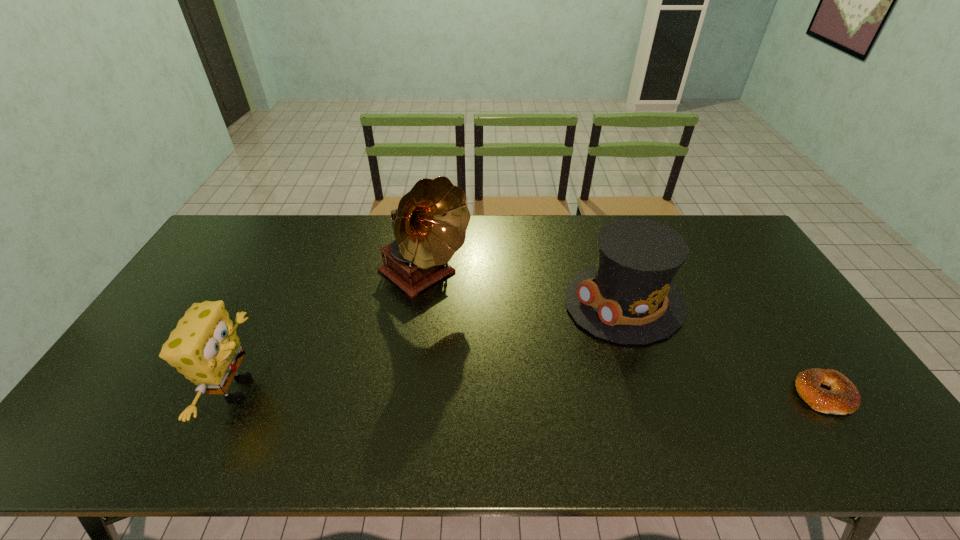
Image resolution: width=960 pixels, height=540 pixels. What are the coordinates of `vacant region at the near edge of the desktop` in the screenshot? It's located at (434, 402).

In the image, there is a desktop. At what (x,y) coordinates should I click in order to perform the action: click on free space at the left edge. Please return your answer as a coordinate pair (x, y). The height and width of the screenshot is (540, 960). Looking at the image, I should click on (170, 315).

In the image, there is a desktop. At what (x,y) coordinates should I click in order to perform the action: click on free space at the right edge. Please return your answer as a coordinate pair (x, y). The height and width of the screenshot is (540, 960). Looking at the image, I should click on (783, 354).

The width and height of the screenshot is (960, 540). In the image, there is a desktop. In order to click on vacant space at the far left corner in this screenshot , I will do `click(219, 253)`.

This screenshot has width=960, height=540. I want to click on empty space that is in between the sponge and the rightmost object, so click(531, 392).

Image resolution: width=960 pixels, height=540 pixels. I want to click on unoccupied position between the leftmost object and the rightmost object, so click(531, 392).

Find the location of `free space between the rightmost object and the sponge`. free space between the rightmost object and the sponge is located at coordinates (531, 392).

The image size is (960, 540). In order to click on vacant area between the dress hat and the sponge in this screenshot , I will do `click(431, 346)`.

I want to click on empty location between the leftmost object and the dress hat, so click(431, 346).

Where is `unoccupied area between the sponge and the shortest object`? Image resolution: width=960 pixels, height=540 pixels. unoccupied area between the sponge and the shortest object is located at coordinates (531, 392).